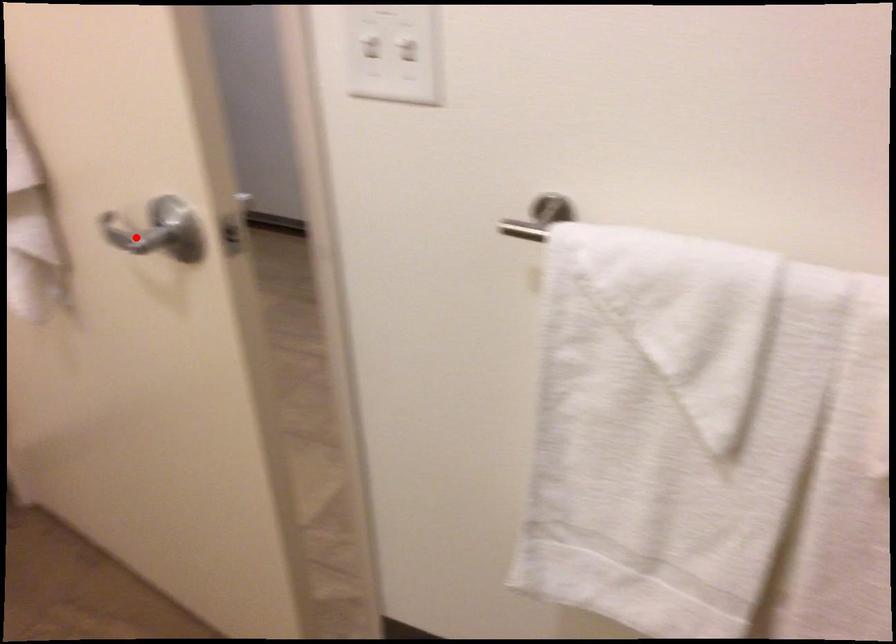
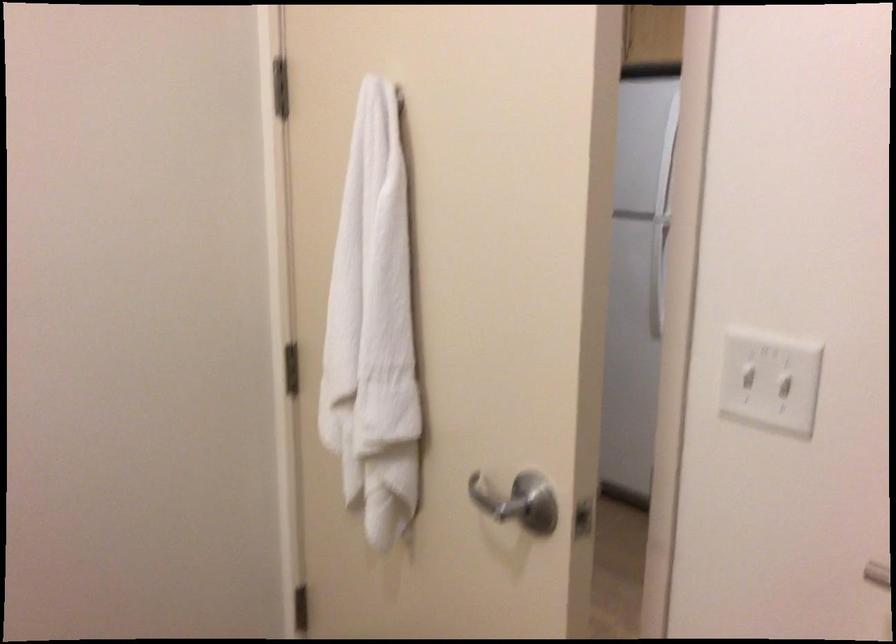
Where in the second image is the point corresponding to the highlighted location from the first image?

(494, 500)